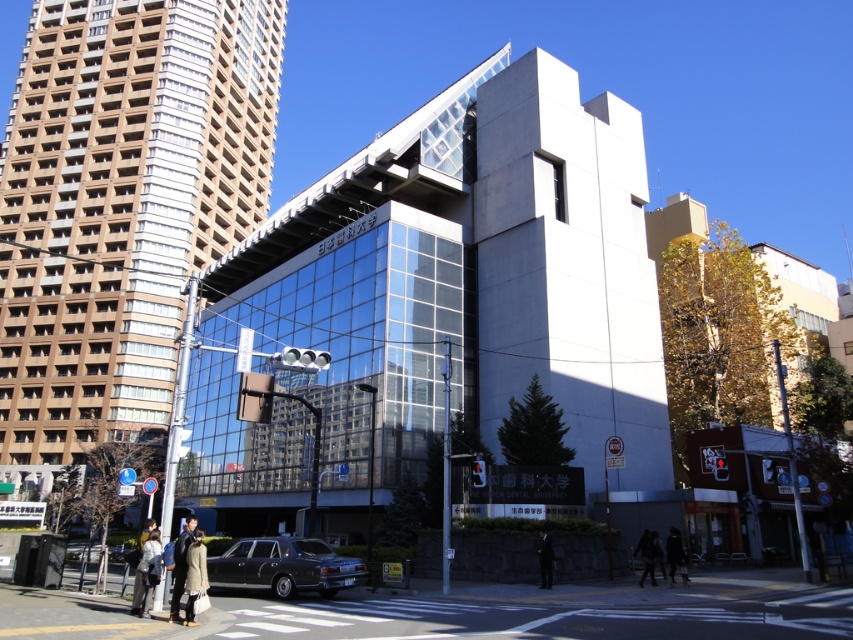
You are standing at the center of the pedestrian crossing in the urban scene. You notice a light beige coat at lower left. Can you determine if the coat is closer to the parked black car or the traffic lights?

The light beige coat at lower left is located at point (146, 573). Since the coordinates place it closer to the parked black car, the coat is nearer to the black car than the traffic lights.